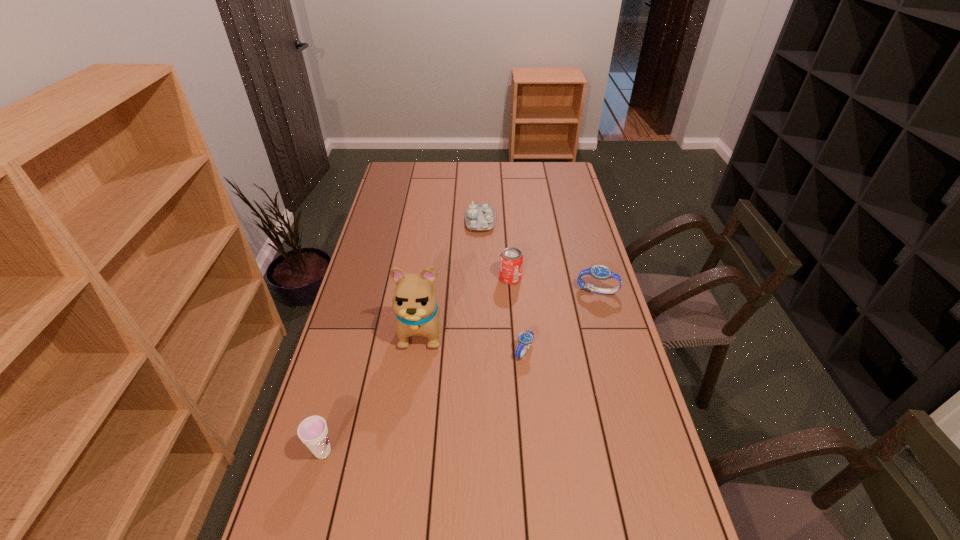
Locate an element on the screen. unoccupied position between the can and the fifth object from right to left is located at coordinates click(x=467, y=302).

Locate an element on the screen. The image size is (960, 540). blank region between the can and the left watch is located at coordinates (517, 314).

The height and width of the screenshot is (540, 960). Find the location of `free space between the right watch and the can`. free space between the right watch and the can is located at coordinates (554, 285).

Locate which object is the third closest to the tallest object. Please provide its 2D coordinates. Your answer should be formatted as a tuple, i.e. [(x, y)], where the tuple contains the x and y coordinates of a point satisfying the conditions above.

[(313, 432)]

Choose which object is the fourth nearest neighbor to the nearest object. Please provide its 2D coordinates. Your answer should be formatted as a tuple, i.e. [(x, y)], where the tuple contains the x and y coordinates of a point satisfying the conditions above.

[(599, 272)]

Where is `vacant space that satisfies the following two spatial constraints: 1. on the back side of the shortest object; 2. on the right side of the rightmost object`? This screenshot has height=540, width=960. vacant space that satisfies the following two spatial constraints: 1. on the back side of the shortest object; 2. on the right side of the rightmost object is located at coordinates 518,291.

Locate an element on the screen. free space in the image that satisfies the following two spatial constraints: 1. on the front side of the farther watch; 2. on the left side of the chinaware is located at coordinates (480, 291).

Where is `blank space that satisfies the following two spatial constraints: 1. on the back side of the cup; 2. on the right side of the nearer watch`? This screenshot has width=960, height=540. blank space that satisfies the following two spatial constraints: 1. on the back side of the cup; 2. on the right side of the nearer watch is located at coordinates (350, 351).

Identify the location of free space that satisfies the following two spatial constraints: 1. on the face of the left watch; 2. on the left side of the tallest object. This screenshot has height=540, width=960. (420, 351).